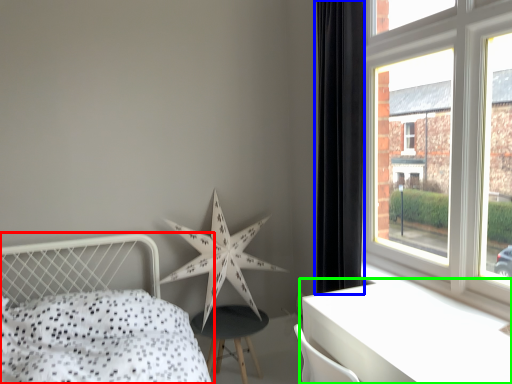
Question: Based on their relative distances, which object is farther from bed (highlighted by a red box)? Choose from curtain (highlighted by a blue box) and table (highlighted by a green box).

Choices:
 (A) curtain
 (B) table

Answer: (A)